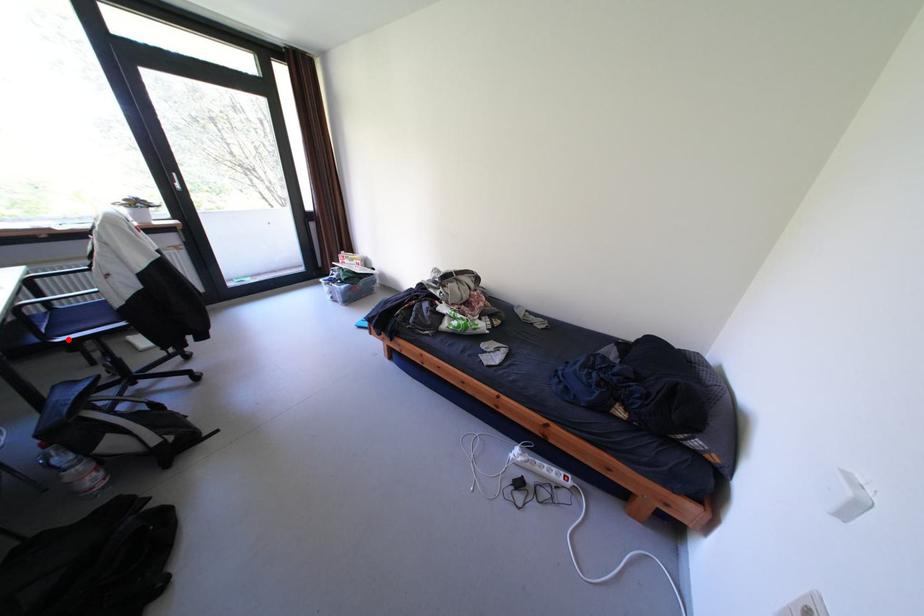
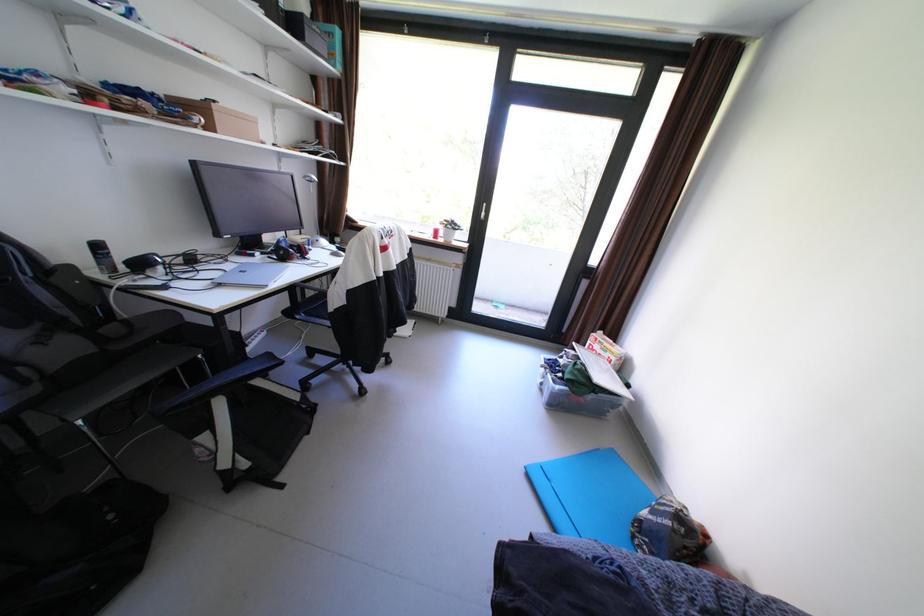
Locate, in the second image, the point that corresponds to the highlighted location in the first image.

(309, 317)